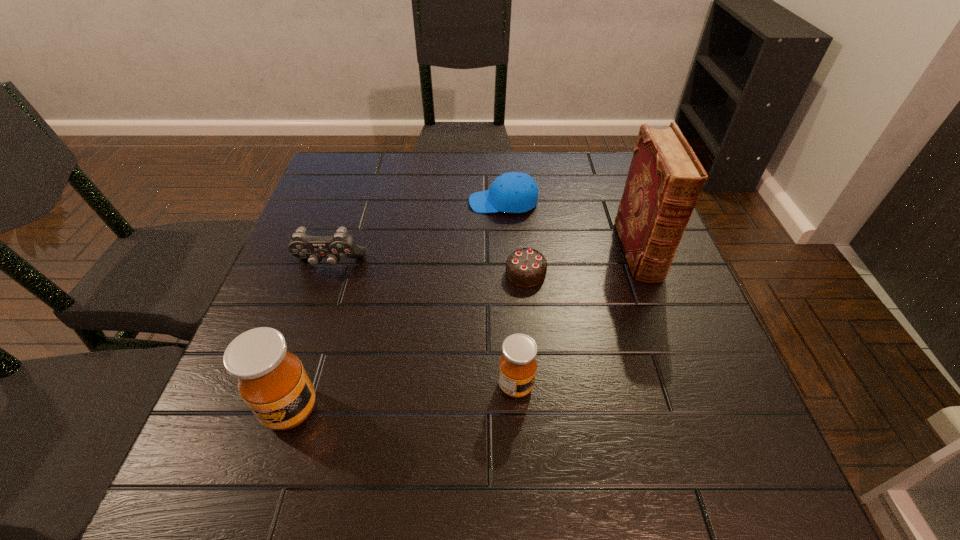
What are the coordinates of `vacant region that satisfies the following two spatial constraints: 1. on the front-facing side of the farthest object; 2. on the front-facing side of the second tallest object` in the screenshot? It's located at (516, 410).

Locate an element on the screen. This screenshot has height=540, width=960. free location that satisfies the following two spatial constraints: 1. on the front-facing side of the cap; 2. on the front-facing side of the left honey is located at coordinates (516, 410).

The height and width of the screenshot is (540, 960). Find the location of `vacant point that satisfies the following two spatial constraints: 1. on the surface of the shortest object with buttons; 2. on the left side of the control`. vacant point that satisfies the following two spatial constraints: 1. on the surface of the shortest object with buttons; 2. on the left side of the control is located at coordinates (326, 273).

Locate an element on the screen. The image size is (960, 540). vacant space that satisfies the following two spatial constraints: 1. on the front-facing side of the cap; 2. on the front-facing side of the taller honey is located at coordinates (516, 410).